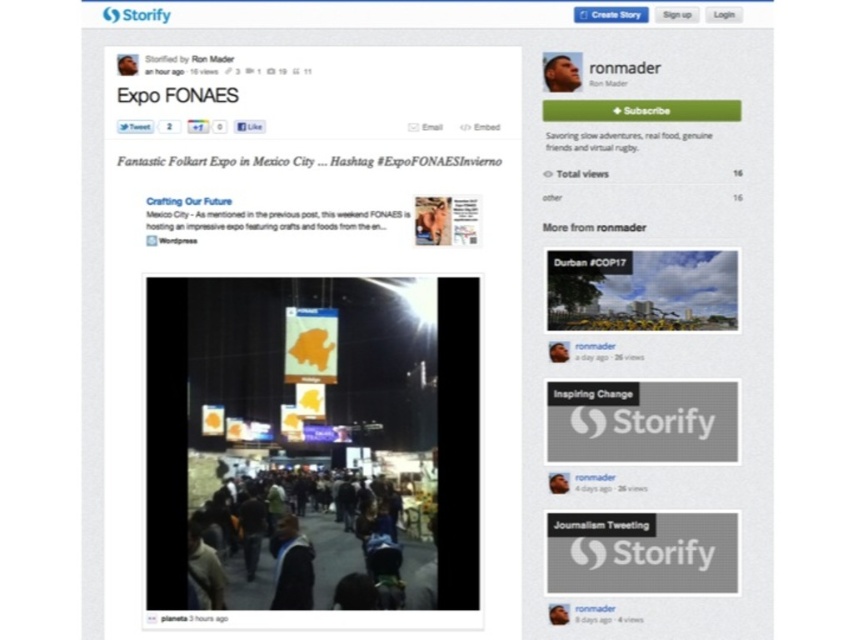
You are standing at the point labeled point (311, 570) and want to walk to the other side of the street. The distance between you and the other side is 4.46 feet. Can you safely cross the street without any obstacles?

The distance between you and the other side is 4.46 feet, so yes, you can safely cross the street without any obstacles.

You are a photographer trying to capture a photo of the smooth skin face at upper right without including the orange fabric banners at center. Based on the scene, is this possible given their positions?

The orange fabric banners at center is below the smooth skin face at upper right, so the photographer can angle the camera upwards to focus on the smooth skin face at upper right while avoiding the orange fabric banners at center below it.